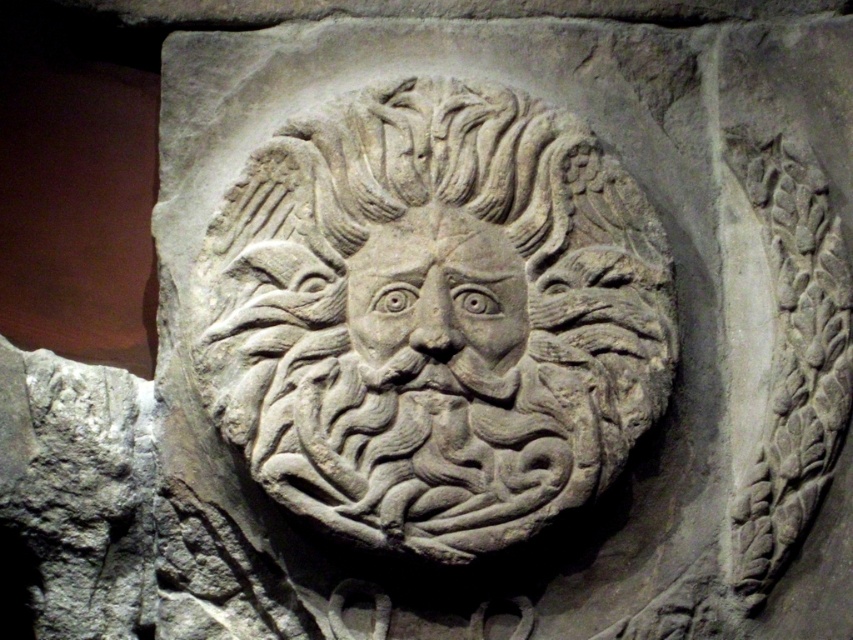
Based on the provided scene description, where is the gray stone lion at center located in terms of its 2D coordinates?

The gray stone lion at center is located at the 2D coordinates of point (434, 317).